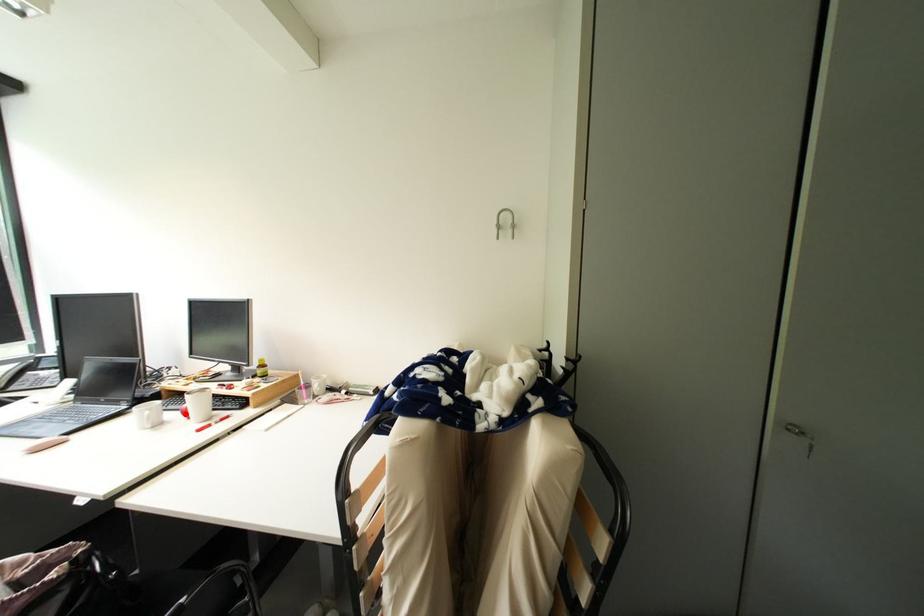
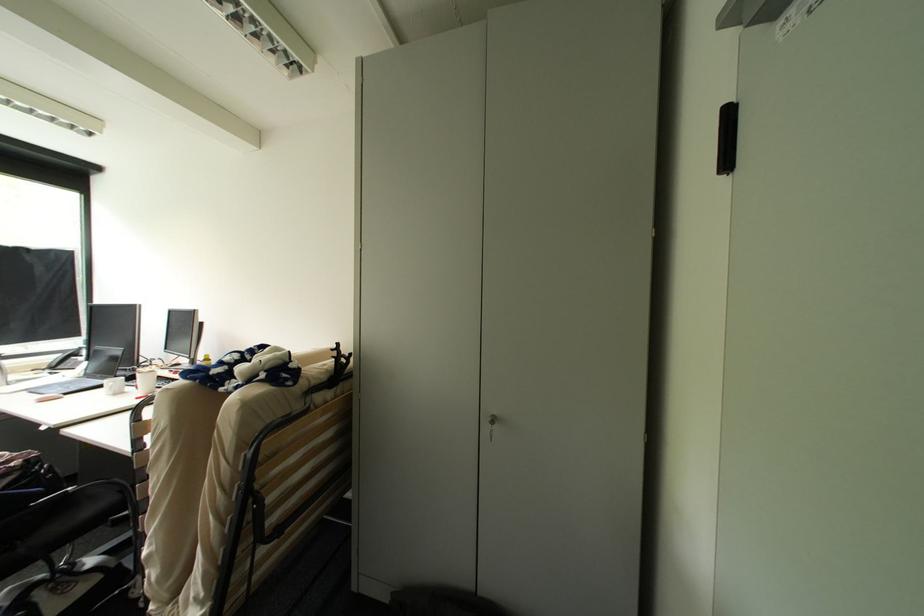
Where in the second image is the point corresponding to the highlighted location from the first image?

(141, 387)